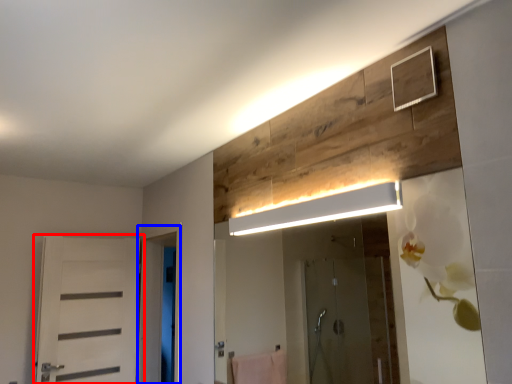
Question: Which point is further to the camera, door (highlighted by a red box) or screen door (highlighted by a blue box)?

Choices:
 (A) door
 (B) screen door

Answer: (A)